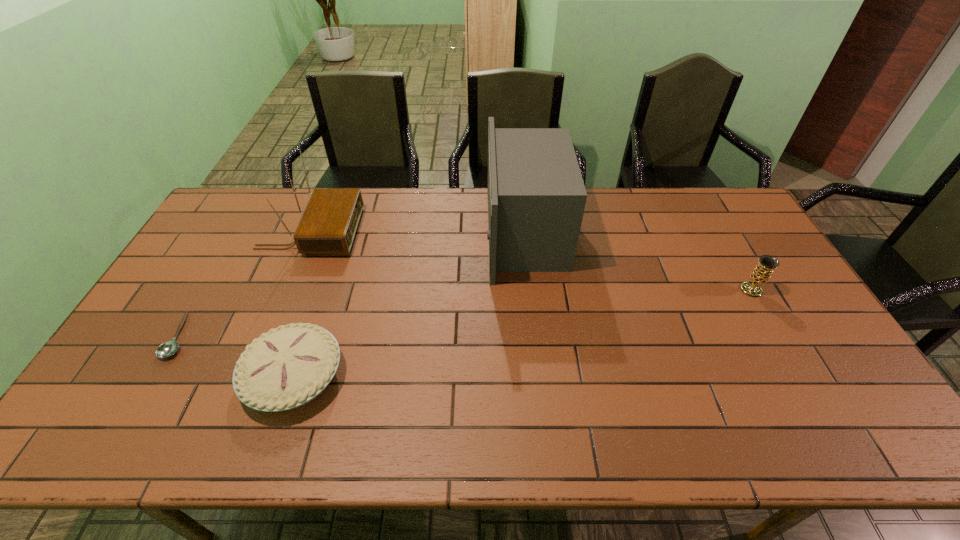
This screenshot has width=960, height=540. What are the coordinates of `free space between the third shortest object and the shortest object` in the screenshot? It's located at (466, 313).

This screenshot has width=960, height=540. I want to click on empty location between the chalice and the microwave oven, so click(x=638, y=262).

Find the location of a particular element. free space between the second object from right to left and the shortest object is located at coordinates (352, 285).

Select which object is the third closest to the fourth object from left to right. Please provide its 2D coordinates. Your answer should be formatted as a tuple, i.e. [(x, y)], where the tuple contains the x and y coordinates of a point satisfying the conditions above.

[(762, 272)]

Where is `the third closest object relative to the rightmost object`? the third closest object relative to the rightmost object is located at coordinates (328, 225).

The image size is (960, 540). Find the location of `free space that satisfies the following two spatial constraints: 1. on the front side of the leftmost object; 2. on the left side of the second shortest object`. free space that satisfies the following two spatial constraints: 1. on the front side of the leftmost object; 2. on the left side of the second shortest object is located at coordinates (156, 376).

Locate an element on the screen. This screenshot has width=960, height=540. free point that satisfies the following two spatial constraints: 1. on the front panel of the radio_receiver; 2. on the back side of the fourth tallest object is located at coordinates (251, 376).

This screenshot has height=540, width=960. Find the location of `vacant position in the image that satisfies the following two spatial constraints: 1. on the front-facing side of the chalice; 2. on the right side of the fourth object from left to right`. vacant position in the image that satisfies the following two spatial constraints: 1. on the front-facing side of the chalice; 2. on the right side of the fourth object from left to right is located at coordinates (531, 290).

Locate an element on the screen. free space in the image that satisfies the following two spatial constraints: 1. on the back side of the pie; 2. on the front panel of the radio_receiver is located at coordinates (342, 233).

The image size is (960, 540). Identify the location of free spot that satisfies the following two spatial constraints: 1. on the front-facing side of the second object from right to left; 2. on the back side of the third tallest object. (531, 290).